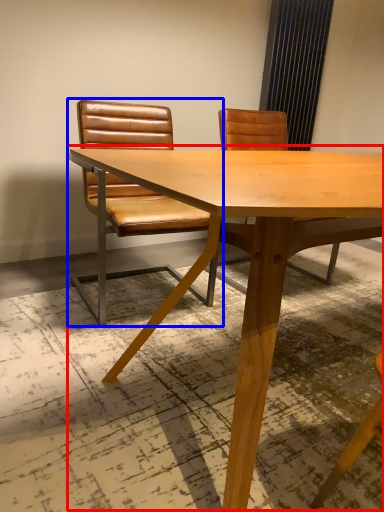
Question: Which of the following is the farthest to the observer, table (highlighted by a red box) or chair (highlighted by a blue box)?

Choices:
 (A) table
 (B) chair

Answer: (B)